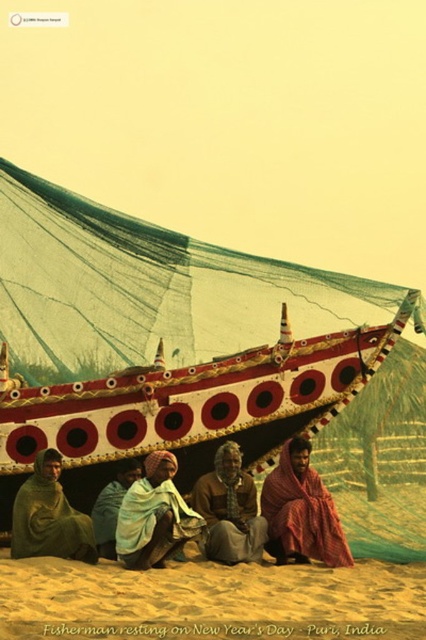
Question: Is green woolen shawl at lower left above brown textured cloth at center?

Choices:
 (A) no
 (B) yes

Answer: (B)

Question: Which object is the farthest from the red woven cloth at lower right?

Choices:
 (A) blue fabric cloth at lower center
 (B) reddish-brown painted wooden boat at center
 (C) green woolen shawl at lower left
 (D) white cotton shawl at lower center

Answer: (C)

Question: Which of the following is the closest to the observer?

Choices:
 (A) blue fabric cloth at lower center
 (B) brown textured cloth at center

Answer: (B)

Question: Which point is farther to the camera?

Choices:
 (A) (175, 536)
 (B) (52, 468)

Answer: (B)

Question: Considering the relative positions of white cotton shawl at lower center and blue fabric cloth at lower center in the image provided, where is white cotton shawl at lower center located with respect to blue fabric cloth at lower center?

Choices:
 (A) right
 (B) left

Answer: (A)

Question: In this image, where is sandy yellow sand at lower center located relative to blue fabric cloth at lower center?

Choices:
 (A) above
 (B) below

Answer: (B)